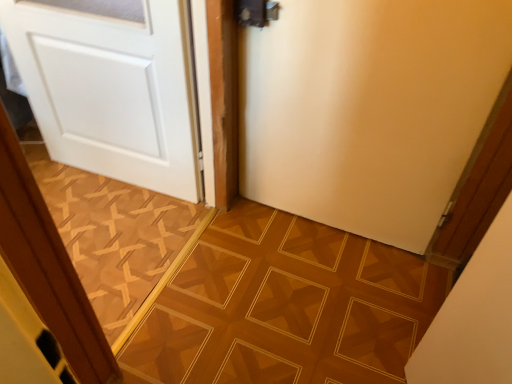
Where is `white matte door at left, which is the 2th door in right-to-left order`? Image resolution: width=512 pixels, height=384 pixels. white matte door at left, which is the 2th door in right-to-left order is located at coordinates (113, 90).

The width and height of the screenshot is (512, 384). What do you see at coordinates (369, 109) in the screenshot? I see `white matte door at center, arranged as the 1th door when viewed from the right` at bounding box center [369, 109].

From the picture: Measure the distance between point (364,140) and camera.

Point (364,140) and camera are 4.96 feet apart from each other.

In order to face brown textured tile at center, positioned as the 2th ceramic tile in right-to-left order, should I rotate leftwards or rightwards?

You should look left and rotate roughly 24.912 degrees.

Find the location of a particular element. The height and width of the screenshot is (384, 512). wooden parquet floor at center, acting as the 1th ceramic tile starting from the right is located at coordinates (285, 306).

Locate an element on the screen. This screenshot has width=512, height=384. white matte door at left, which is the first door in left-to-right order is located at coordinates (113, 90).

From the image's perspective, does brown textured tile at center, arranged as the first ceramic tile when viewed from the left, appear higher than white matte door at left, which is the first door in left-to-right order?

No.

From a real-world perspective, relative to white matte door at left, which is the 2th door in right-to-left order, is brown textured tile at center, arranged as the first ceramic tile when viewed from the left, vertically above or below?

brown textured tile at center, arranged as the first ceramic tile when viewed from the left, is below white matte door at left, which is the 2th door in right-to-left order.

Is brown textured tile at center, arranged as the first ceramic tile when viewed from the left, next to white matte door at left, which is the first door in left-to-right order?

No, brown textured tile at center, arranged as the first ceramic tile when viewed from the left, is not beside white matte door at left, which is the first door in left-to-right order.

From the image's perspective, count 1st ceramic tiles downward from the white matte door at left, which is the first door in left-to-right order, and point to it. Please provide its 2D coordinates.

[(116, 238)]

Which of these two, wooden parquet floor at center, acting as the 1th ceramic tile starting from the right, or white matte door at center, arranged as the 1th door when viewed from the right, is smaller?

Smaller between the two is wooden parquet floor at center, acting as the 1th ceramic tile starting from the right.

From the image's perspective, is wooden parquet floor at center, acting as the 1th ceramic tile starting from the right, on white matte door at center, arranged as the second door when viewed from the left?

Incorrect, from the image's perspective, wooden parquet floor at center, acting as the 1th ceramic tile starting from the right, is lower than white matte door at center, arranged as the second door when viewed from the left.

Would you say wooden parquet floor at center, marked as the 2th ceramic tile in a left-to-right arrangement, is outside white matte door at center, arranged as the second door when viewed from the left?

Indeed, wooden parquet floor at center, marked as the 2th ceramic tile in a left-to-right arrangement, is completely outside white matte door at center, arranged as the second door when viewed from the left.

Is wooden parquet floor at center, marked as the 2th ceramic tile in a left-to-right arrangement, not near white matte door at center, arranged as the second door when viewed from the left?

No, wooden parquet floor at center, marked as the 2th ceramic tile in a left-to-right arrangement, is in close proximity to white matte door at center, arranged as the second door when viewed from the left.

Is point (417, 304) closer or farther from the camera than point (147, 300)?

Clearly, point (417, 304) is more distant from the camera than point (147, 300).

Consider the image. Which is in front, wooden parquet floor at center, marked as the 2th ceramic tile in a left-to-right arrangement, or brown textured tile at center, arranged as the first ceramic tile when viewed from the left?

wooden parquet floor at center, marked as the 2th ceramic tile in a left-to-right arrangement, is closer to the camera.

In terms of width, does wooden parquet floor at center, marked as the 2th ceramic tile in a left-to-right arrangement, look wider or thinner when compared to brown textured tile at center, arranged as the first ceramic tile when viewed from the left?

In the image, wooden parquet floor at center, marked as the 2th ceramic tile in a left-to-right arrangement, appears to be more narrow than brown textured tile at center, arranged as the first ceramic tile when viewed from the left.

Which is in front, point (130, 25) or point (364, 149)?

The point (130, 25) is more forward.

Can you confirm if white matte door at left, which is the 2th door in right-to-left order, is bigger than white matte door at center, arranged as the 1th door when viewed from the right?

Correct, white matte door at left, which is the 2th door in right-to-left order, is larger in size than white matte door at center, arranged as the 1th door when viewed from the right.

Is white matte door at center, arranged as the 1th door when viewed from the right, at the back of white matte door at left, which is the first door in left-to-right order?

No, white matte door at center, arranged as the 1th door when viewed from the right, is not at the back of white matte door at left, which is the first door in left-to-right order.

Would you say white matte door at left, which is the first door in left-to-right order, is to the left or to the right of white matte door at center, arranged as the 1th door when viewed from the right, in the picture?

white matte door at left, which is the first door in left-to-right order, is to the left of white matte door at center, arranged as the 1th door when viewed from the right.

Is wooden parquet floor at center, marked as the 2th ceramic tile in a left-to-right arrangement, far from white matte door at left, which is the first door in left-to-right order?

No, wooden parquet floor at center, marked as the 2th ceramic tile in a left-to-right arrangement, is in close proximity to white matte door at left, which is the first door in left-to-right order.

Can you confirm if wooden parquet floor at center, marked as the 2th ceramic tile in a left-to-right arrangement, is positioned to the left of white matte door at left, which is the 2th door in right-to-left order?

No.

Is wooden parquet floor at center, acting as the 1th ceramic tile starting from the right, looking in the opposite direction of white matte door at left, which is the 2th door in right-to-left order?

wooden parquet floor at center, acting as the 1th ceramic tile starting from the right, does not have its back to white matte door at left, which is the 2th door in right-to-left order.

Are white matte door at center, arranged as the 1th door when viewed from the right, and white matte door at left, which is the first door in left-to-right order, located far from each other?

No, white matte door at center, arranged as the 1th door when viewed from the right, is not far from white matte door at left, which is the first door in left-to-right order.

What's the angular difference between white matte door at center, arranged as the second door when viewed from the left, and white matte door at left, which is the 2th door in right-to-left order,'s facing directions?

The angular difference between white matte door at center, arranged as the second door when viewed from the left, and white matte door at left, which is the 2th door in right-to-left order, is 2.68 degrees.

From the image's perspective, is white matte door at center, arranged as the second door when viewed from the left, above or below white matte door at left, which is the 2th door in right-to-left order?

Clearly, from the image's perspective, white matte door at center, arranged as the second door when viewed from the left, is below white matte door at left, which is the 2th door in right-to-left order.

In the scene shown: Considering the relative positions of white matte door at center, arranged as the second door when viewed from the left, and white matte door at left, which is the first door in left-to-right order, in the image provided, is white matte door at center, arranged as the second door when viewed from the left, to the left or to the right of white matte door at left, which is the first door in left-to-right order,?

Based on their positions, white matte door at center, arranged as the second door when viewed from the left, is located to the right of white matte door at left, which is the first door in left-to-right order.

From the image's perspective, which is below, white matte door at left, which is the first door in left-to-right order, or wooden parquet floor at center, acting as the 1th ceramic tile starting from the right?

From the image's view, wooden parquet floor at center, acting as the 1th ceramic tile starting from the right, is below.

From the picture: Is white matte door at left, which is the first door in left-to-right order, positioned far away from wooden parquet floor at center, acting as the 1th ceramic tile starting from the right?

white matte door at left, which is the first door in left-to-right order, is actually quite close to wooden parquet floor at center, acting as the 1th ceramic tile starting from the right.

Which of these two, white matte door at left, which is the 2th door in right-to-left order, or wooden parquet floor at center, acting as the 1th ceramic tile starting from the right, is bigger?

With larger size is white matte door at left, which is the 2th door in right-to-left order.

Is white matte door at left, which is the first door in left-to-right order, not inside wooden parquet floor at center, marked as the 2th ceramic tile in a left-to-right arrangement?

Yes, white matte door at left, which is the first door in left-to-right order, is outside of wooden parquet floor at center, marked as the 2th ceramic tile in a left-to-right arrangement.

I want to click on ceramic tile that appears behind the white matte door at left, which is the 2th door in right-to-left order, so click(x=116, y=238).

The image size is (512, 384). Find the location of `the 2nd ceramic tile below the white matte door at center, arranged as the second door when viewed from the left (from the image's perspective)`. the 2nd ceramic tile below the white matte door at center, arranged as the second door when viewed from the left (from the image's perspective) is located at coordinates (285, 306).

From the image, which object appears to be farther from white matte door at left, which is the first door in left-to-right order, wooden parquet floor at center, acting as the 1th ceramic tile starting from the right, or white matte door at center, arranged as the second door when viewed from the left?

wooden parquet floor at center, acting as the 1th ceramic tile starting from the right.

Estimate the real-world distances between objects in this image. Which object is closer to brown textured tile at center, arranged as the first ceramic tile when viewed from the left, white matte door at center, arranged as the 1th door when viewed from the right, or wooden parquet floor at center, marked as the 2th ceramic tile in a left-to-right arrangement?

wooden parquet floor at center, marked as the 2th ceramic tile in a left-to-right arrangement.

Which object lies further to the anchor point wooden parquet floor at center, marked as the 2th ceramic tile in a left-to-right arrangement, white matte door at left, which is the first door in left-to-right order, or white matte door at center, arranged as the 1th door when viewed from the right?

Among the two, white matte door at left, which is the first door in left-to-right order, is located further to wooden parquet floor at center, marked as the 2th ceramic tile in a left-to-right arrangement.

Based on their spatial positions, is wooden parquet floor at center, acting as the 1th ceramic tile starting from the right, or white matte door at left, which is the first door in left-to-right order, further from brown textured tile at center, positioned as the 2th ceramic tile in right-to-left order?

The object further to brown textured tile at center, positioned as the 2th ceramic tile in right-to-left order, is wooden parquet floor at center, acting as the 1th ceramic tile starting from the right.

Estimate the real-world distances between objects in this image. Which object is closer to brown textured tile at center, arranged as the first ceramic tile when viewed from the left, white matte door at left, which is the first door in left-to-right order, or wooden parquet floor at center, marked as the 2th ceramic tile in a left-to-right arrangement?

white matte door at left, which is the first door in left-to-right order.

From the image, which object appears to be farther from white matte door at left, which is the 2th door in right-to-left order, wooden parquet floor at center, marked as the 2th ceramic tile in a left-to-right arrangement, or brown textured tile at center, arranged as the first ceramic tile when viewed from the left?

Among the two, wooden parquet floor at center, marked as the 2th ceramic tile in a left-to-right arrangement, is located further to white matte door at left, which is the 2th door in right-to-left order.

Looking at this image, which object lies nearer to the anchor point white matte door at center, arranged as the 1th door when viewed from the right, brown textured tile at center, arranged as the first ceramic tile when viewed from the left, or white matte door at left, which is the 2th door in right-to-left order?

Among the two, white matte door at left, which is the 2th door in right-to-left order, is located nearer to white matte door at center, arranged as the 1th door when viewed from the right.

From the image, which object appears to be farther from wooden parquet floor at center, marked as the 2th ceramic tile in a left-to-right arrangement, white matte door at center, arranged as the second door when viewed from the left, or brown textured tile at center, positioned as the 2th ceramic tile in right-to-left order?

Among the two, white matte door at center, arranged as the second door when viewed from the left, is located further to wooden parquet floor at center, marked as the 2th ceramic tile in a left-to-right arrangement.

Identify the location of door between brown textured tile at center, positioned as the 2th ceramic tile in right-to-left order, and white matte door at center, arranged as the 1th door when viewed from the right, in the horizontal direction. Image resolution: width=512 pixels, height=384 pixels. (113, 90).

The image size is (512, 384). In order to click on door between brown textured tile at center, arranged as the first ceramic tile when viewed from the left, and wooden parquet floor at center, acting as the 1th ceramic tile starting from the right, from left to right in this screenshot , I will do `click(113, 90)`.

You are a GUI agent. You are given a task and a screenshot of the screen. Output one action in this format:
    pyautogui.click(x=<x>, y=<y>)
    Task: Click on the ceramic tile between brown textured tile at center, positioned as the 2th ceramic tile in right-to-left order, and white matte door at center, arranged as the 1th door when viewed from the right, in the horizontal direction
    This screenshot has height=384, width=512.
    Given the screenshot: What is the action you would take?
    pyautogui.click(x=285, y=306)

The width and height of the screenshot is (512, 384). What are the coordinates of `ceramic tile between white matte door at left, which is the 2th door in right-to-left order, and white matte door at center, arranged as the 1th door when viewed from the right, in the horizontal direction` in the screenshot? It's located at (285, 306).